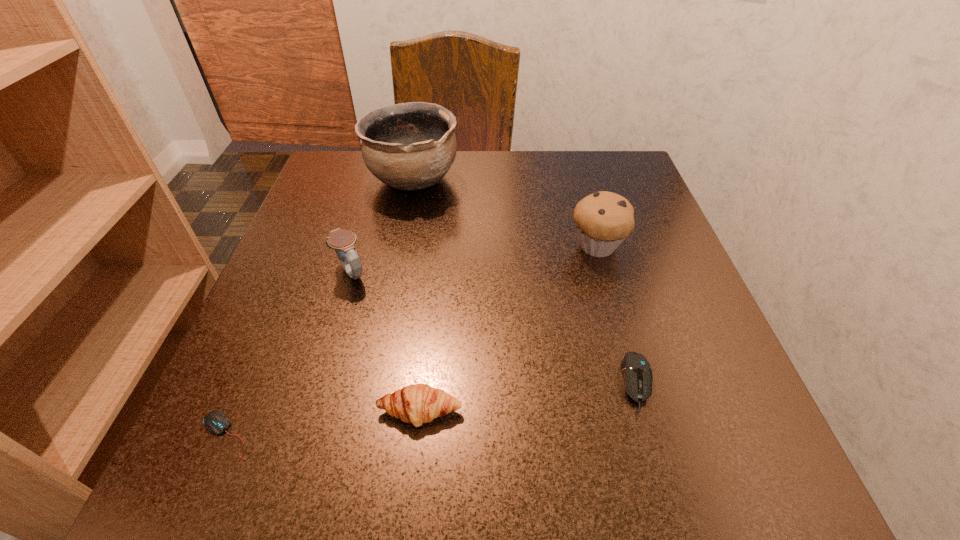
This screenshot has width=960, height=540. In the image, there is a desktop. What are the coordinates of `free space at the near right corner` in the screenshot? It's located at (672, 449).

This screenshot has width=960, height=540. Identify the location of empty location between the left mouse and the watch. (289, 354).

Locate an element on the screen. free space between the taller mouse and the farthest object is located at coordinates (525, 281).

This screenshot has height=540, width=960. I want to click on free space between the fourth tallest object and the tallest object, so click(x=417, y=295).

You are a GUI agent. You are given a task and a screenshot of the screen. Output one action in this format:
    pyautogui.click(x=<x>, y=<y>)
    Task: Click on the free space between the shortest object and the fourth tallest object
    
    Given the screenshot: What is the action you would take?
    pyautogui.click(x=324, y=423)

You are a GUI agent. You are given a task and a screenshot of the screen. Output one action in this format:
    pyautogui.click(x=<x>, y=<y>)
    Task: Click on the free space between the farthest object and the taller mouse
    
    Given the screenshot: What is the action you would take?
    pyautogui.click(x=525, y=281)

Image resolution: width=960 pixels, height=540 pixels. In order to click on unoccupied position between the third tallest object and the fifth shortest object in this screenshot , I will do `click(474, 260)`.

This screenshot has width=960, height=540. Find the location of `empty space that is in between the left mouse and the muffin`. empty space that is in between the left mouse and the muffin is located at coordinates (412, 341).

Find the location of a particular element. The width and height of the screenshot is (960, 540). vacant area between the third shortest object and the tallest object is located at coordinates (417, 295).

Where is `vacant area between the second tallest object and the leftmost object`? This screenshot has width=960, height=540. vacant area between the second tallest object and the leftmost object is located at coordinates (412, 341).